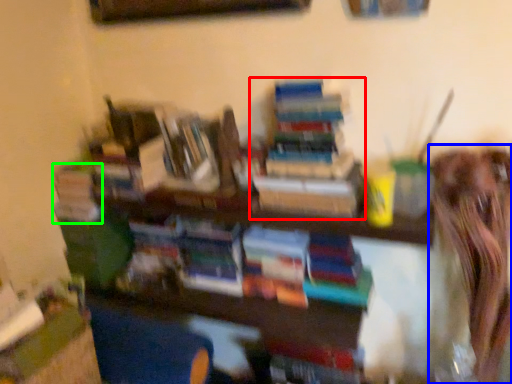
Question: Estimate the real-world distances between objects in this image. Which object is closer to book (highlighted by a red box), person (highlighted by a blue box) or book (highlighted by a green box)?

Choices:
 (A) person
 (B) book

Answer: (A)